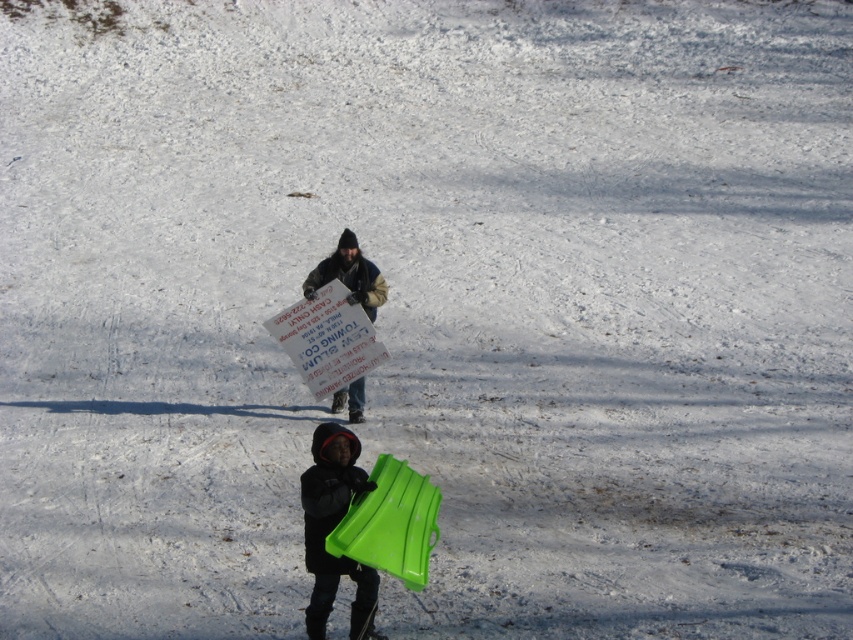
Question: Which point appears closest to the camera in this image?

Choices:
 (A) (320, 557)
 (B) (346, 282)

Answer: (A)

Question: Does matte green sled at lower center appear on the right side of matte cardboard sign at center?

Choices:
 (A) yes
 (B) no

Answer: (A)

Question: Which point appears closest to the camera in this image?

Choices:
 (A) (360, 289)
 (B) (306, 502)

Answer: (B)

Question: Does matte green sled at lower center have a smaller size compared to matte cardboard sign at center?

Choices:
 (A) yes
 (B) no

Answer: (B)

Question: Does matte green sled at lower center appear over matte cardboard sign at center?

Choices:
 (A) yes
 (B) no

Answer: (B)